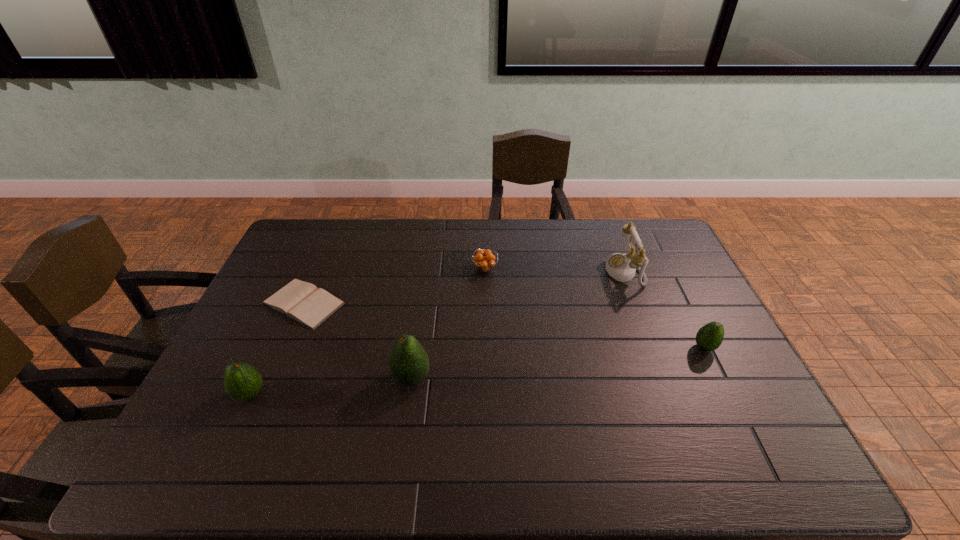
Find the location of `vacant point located 0.180m on the right of the fourth shortest object`. vacant point located 0.180m on the right of the fourth shortest object is located at coordinates (337, 394).

Identify the location of vacant area located 0.150m on the right of the fourth object from right to left. This screenshot has width=960, height=540. (488, 377).

This screenshot has width=960, height=540. I want to click on vacant space located 0.100m on the left of the rightmost object, so click(x=658, y=347).

Where is `vacant space located on the dial of the telephone`? The height and width of the screenshot is (540, 960). vacant space located on the dial of the telephone is located at coordinates (553, 272).

Identify the location of vacant region located 0.250m on the dial of the telephone. (533, 272).

Locate an element on the screen. Image resolution: width=960 pixels, height=540 pixels. free space located 0.380m on the dial of the telephone is located at coordinates (494, 272).

I want to click on vacant point located on the right of the third object from right to left, so click(570, 268).

In order to click on blank area located on the back of the Bible in this screenshot , I will do `click(337, 225)`.

Where is `object located in the far edge section of the desktop`? This screenshot has width=960, height=540. object located in the far edge section of the desktop is located at coordinates (622, 267).

Find the location of a particular element. The height and width of the screenshot is (540, 960). object present at the near edge is located at coordinates (242, 381).